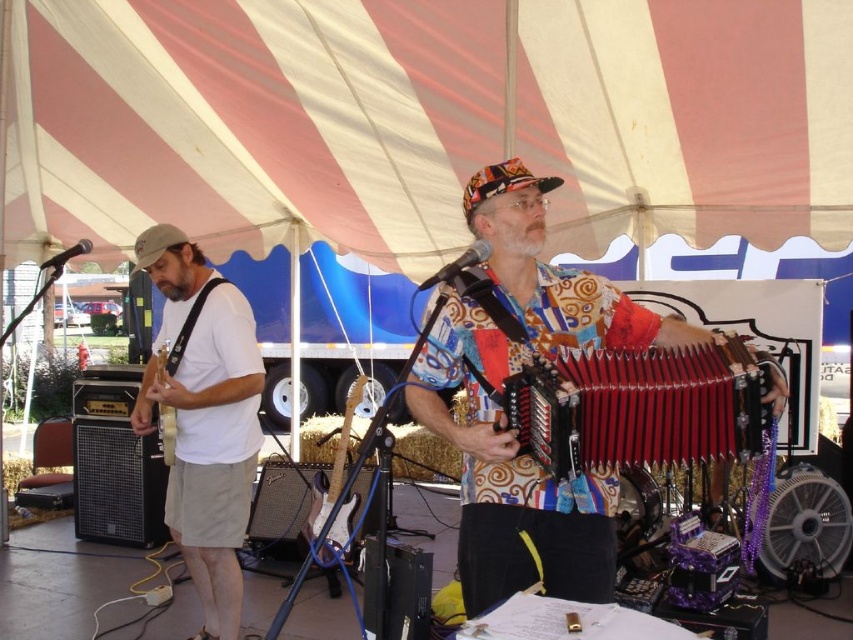
Question: Can you confirm if brushed metal electric guitar at center is bigger than wooden electric guitar at left?

Choices:
 (A) yes
 (B) no

Answer: (A)

Question: Considering the relative positions of white matte guitar at left and multicolored fabric hat at center in the image provided, where is white matte guitar at left located with respect to multicolored fabric hat at center?

Choices:
 (A) right
 (B) left

Answer: (B)

Question: Which of the following is the farthest from the observer?

Choices:
 (A) (355, 380)
 (B) (531, 214)
 (C) (560, 472)

Answer: (A)

Question: Estimate the real-world distances between objects in this image. Which object is farther from the brushed metal electric guitar at center?

Choices:
 (A) wooden electric guitar at left
 (B) white matte beard at center
 (C) red leather accordion at center
 (D) multicolored fabric shirt at center

Answer: (C)

Question: Is white matte guitar at left above white matte beard at center?

Choices:
 (A) no
 (B) yes

Answer: (A)

Question: Which point is closer to the camera taking this photo?

Choices:
 (A) (781, 390)
 (B) (332, 544)
 (C) (167, 424)
 (D) (163, 273)

Answer: (A)